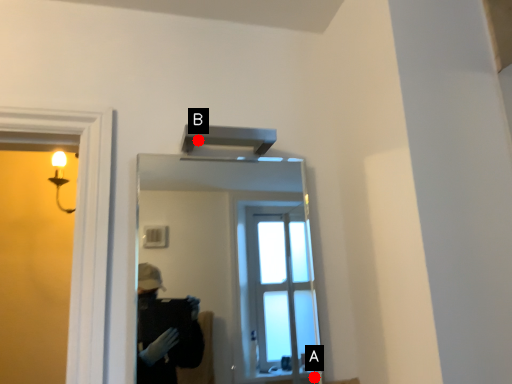
Question: Two points are circled on the image, labeled by A and B beside each circle. Which of the following is the farthest from the observer?

Choices:
 (A) A is further
 (B) B is further

Answer: (A)